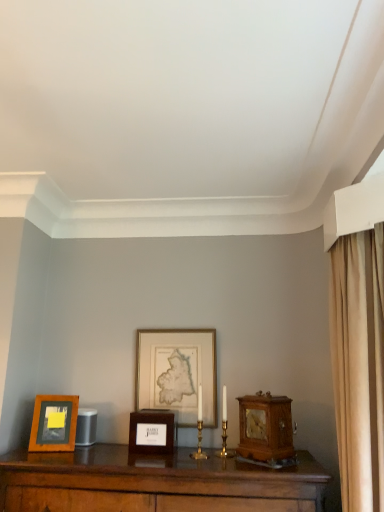
Question: Can you confirm if wooden picture frame at left, which ranks as the first picture frame in left-to-right order, is positioned to the right of wooden alarm clock at right?

Choices:
 (A) no
 (B) yes

Answer: (A)

Question: Is wooden picture frame at left, the third picture frame in the right-to-left sequence, at the left side of wooden alarm clock at right?

Choices:
 (A) yes
 (B) no

Answer: (A)

Question: Is wooden picture frame at left, which ranks as the first picture frame in left-to-right order, facing away from wooden alarm clock at right?

Choices:
 (A) no
 (B) yes

Answer: (A)

Question: Are wooden picture frame at left, the third picture frame in the right-to-left sequence, and wooden alarm clock at right making contact?

Choices:
 (A) yes
 (B) no

Answer: (B)

Question: Does wooden picture frame at left, which ranks as the first picture frame in left-to-right order, come behind wooden alarm clock at right?

Choices:
 (A) yes
 (B) no

Answer: (A)

Question: Is wooden picture frame at left, the third picture frame in the right-to-left sequence, smaller than wooden alarm clock at right?

Choices:
 (A) no
 (B) yes

Answer: (B)

Question: Is gold-framed map at center, the third picture frame from the left, not inside wooden alarm clock at right?

Choices:
 (A) no
 (B) yes

Answer: (B)

Question: From a real-world perspective, is gold-framed map at center, which is the first picture frame in right-to-left order, positioned under wooden alarm clock at right based on gravity?

Choices:
 (A) no
 (B) yes

Answer: (A)

Question: From the image's perspective, is gold-framed map at center, the third picture frame from the left, beneath wooden alarm clock at right?

Choices:
 (A) yes
 (B) no

Answer: (B)

Question: Could you tell me if gold-framed map at center, the third picture frame from the left, is facing wooden alarm clock at right?

Choices:
 (A) no
 (B) yes

Answer: (A)

Question: Is there a large distance between gold-framed map at center, which is the first picture frame in right-to-left order, and wooden alarm clock at right?

Choices:
 (A) no
 (B) yes

Answer: (A)

Question: Can you confirm if gold-framed map at center, which is the first picture frame in right-to-left order, is smaller than wooden alarm clock at right?

Choices:
 (A) no
 (B) yes

Answer: (A)

Question: Does gold-framed map at center, which is the first picture frame in right-to-left order, appear on the left side of wooden picture frame at center, which is the 2th picture frame in right-to-left order?

Choices:
 (A) no
 (B) yes

Answer: (A)